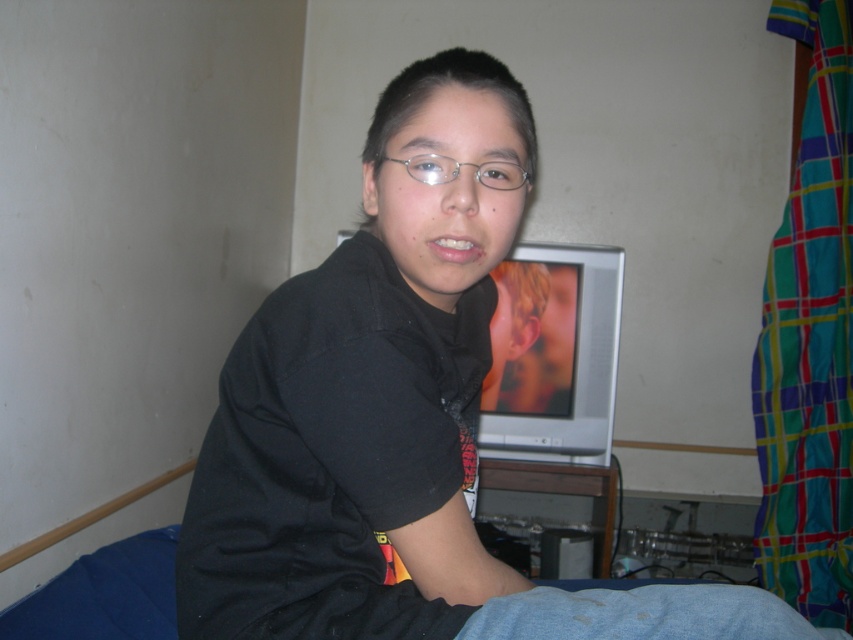
Question: Is black matte shirt at center to the right of clear plastic glasses at center from the viewer's perspective?

Choices:
 (A) no
 (B) yes

Answer: (A)

Question: Does black matte shirt at center come in front of clear plastic glasses at center?

Choices:
 (A) no
 (B) yes

Answer: (B)

Question: Which point is closer to the camera?

Choices:
 (A) (305, 408)
 (B) (410, 173)

Answer: (A)

Question: Is black matte shirt at center positioned behind clear plastic glasses at center?

Choices:
 (A) no
 (B) yes

Answer: (A)

Question: Among these points, which one is farthest from the camera?

Choices:
 (A) (503, 72)
 (B) (515, 170)

Answer: (A)